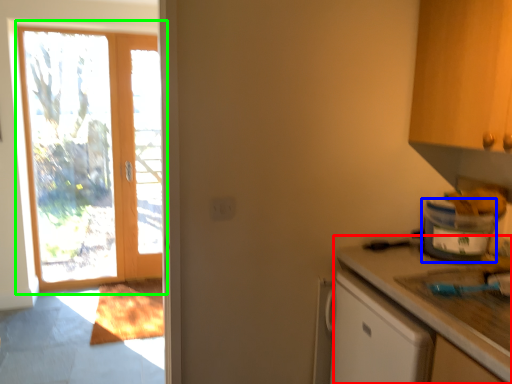
Question: Based on their relative distances, which object is nearer to countertop (highlighted by a red box)? Choose from appliance (highlighted by a blue box) and door (highlighted by a green box).

Choices:
 (A) appliance
 (B) door

Answer: (A)